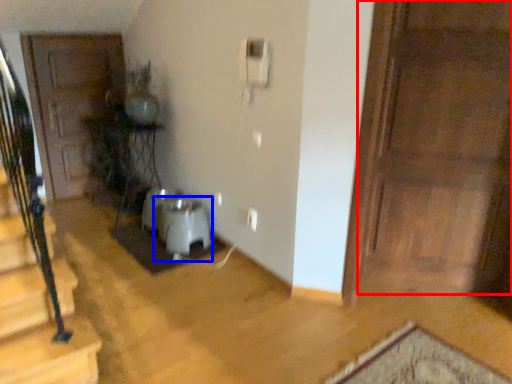
Question: Among these objects, which one is nearest to the camera, door (highlighted by a red box) or water heater (highlighted by a blue box)?

Choices:
 (A) door
 (B) water heater

Answer: (A)